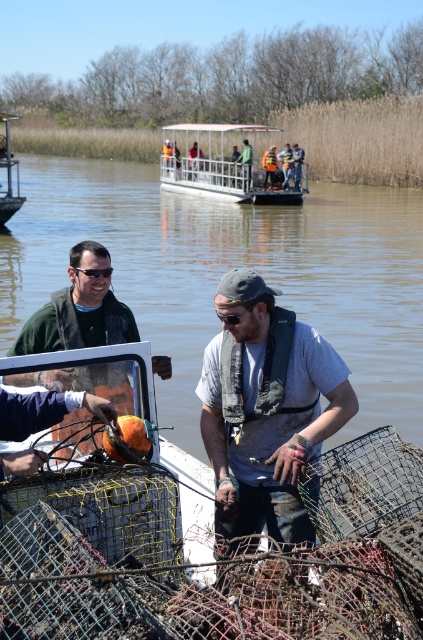
Based on the scene description, where exactly is the clear water at boat center located?

The clear water at boat center is located at point coordinates of (228, 268).

You are standing on the dock and see the clear water at boat center and the green matte jacket at center. Which object is closer to your right side?

The clear water at boat center is closer to your right side because it is positioned to the right of the green matte jacket at center.

You are standing on the boat and see two points in the water. The first point is at coordinates point (159, 276) and the second point is at point (164, 372). Which point is closer to you?

Point (159, 276) is closer to you because it is further to the viewer than point (164, 372).